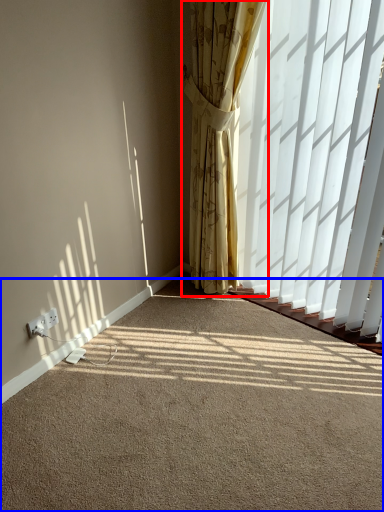
Question: Among these objects, which one is nearest to the camera, curtain (highlighted by a red box) or plain (highlighted by a blue box)?

Choices:
 (A) curtain
 (B) plain

Answer: (B)